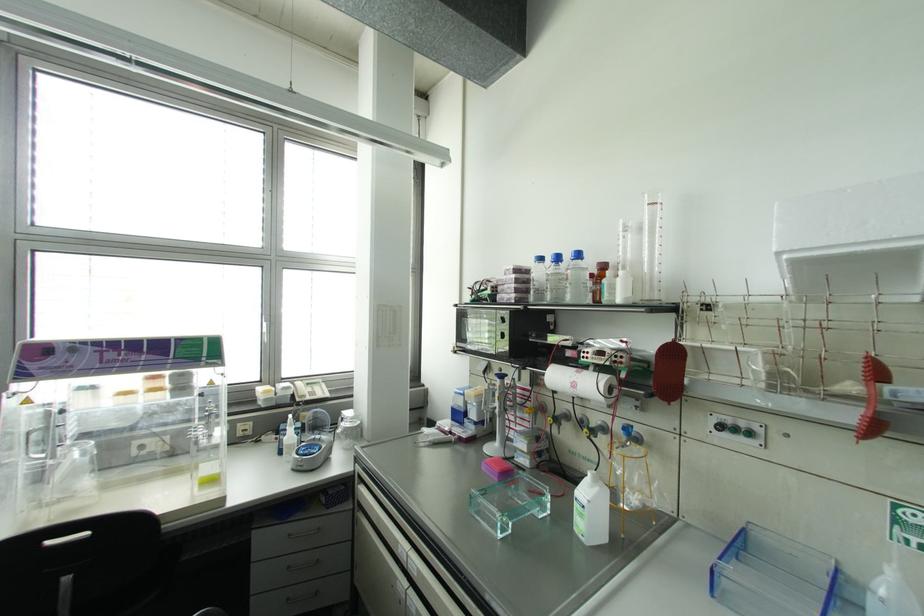
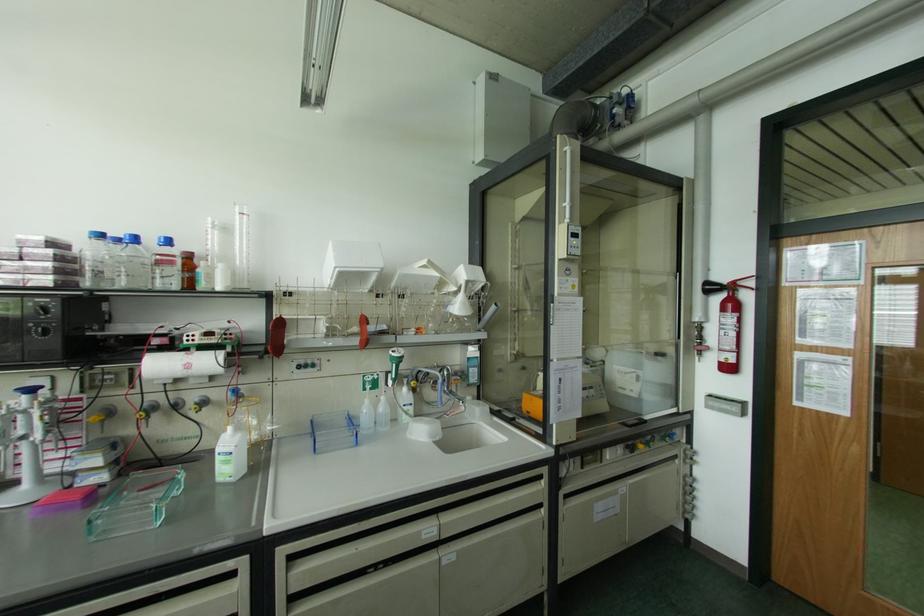
Question: I am providing you with two images of the same scene from different viewpoints. Which of the following objects are not visible in image2?

Choices:
 (A) brown glass bottle
 (B) yellow control knob
 (C) blue control knob
 (D) none of these

Answer: (D)